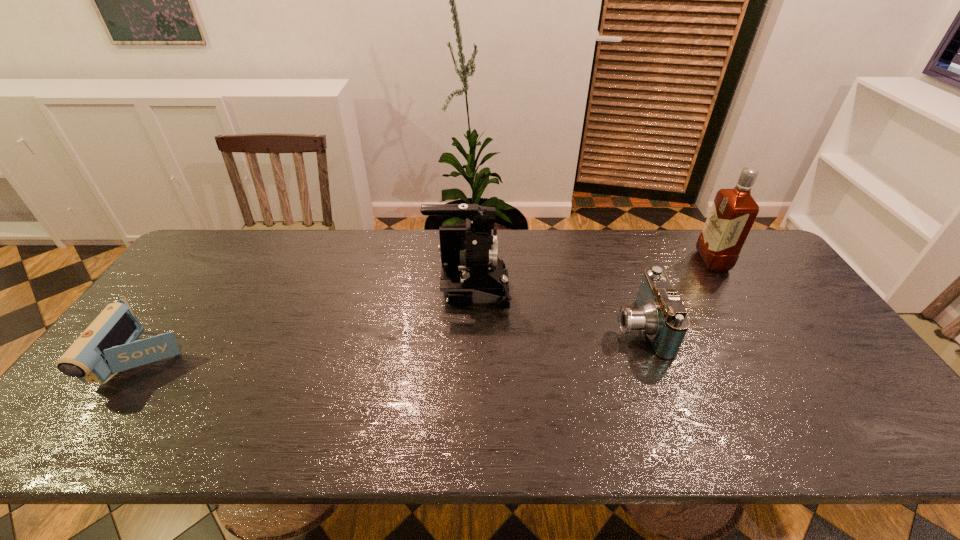
Identify the location of liquor. This screenshot has height=540, width=960. (733, 212).

Where is `the tallest camcorder`? the tallest camcorder is located at coordinates (471, 272).

The image size is (960, 540). What are the coordinates of `the second camcorder from right to left` in the screenshot? It's located at (471, 272).

Find the location of `the third object from left to right`. the third object from left to right is located at coordinates (660, 314).

Locate an element on the screen. The image size is (960, 540). the leftmost camcorder is located at coordinates (109, 345).

This screenshot has height=540, width=960. What are the coordinates of `free space located on the front label of the rightmost object` in the screenshot? It's located at 613,261.

This screenshot has width=960, height=540. Identify the location of blank space located on the front label of the rightmost object. (675, 261).

At what (x,y) coordinates should I click in order to perform the action: click on free region located on the front label of the rightmost object. Please return your answer as a coordinate pair (x, y). The image size is (960, 540). Looking at the image, I should click on (675, 261).

I want to click on free region located on the lens mount of the second camcorder from right to left, so click(572, 290).

Image resolution: width=960 pixels, height=540 pixels. Find the location of `vacant space located on the front-facing side of the rightmost camcorder`. vacant space located on the front-facing side of the rightmost camcorder is located at coordinates (593, 328).